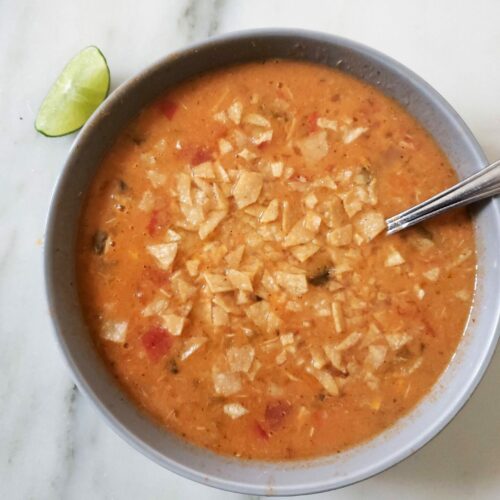
Image resolution: width=500 pixels, height=500 pixels. What are the coordinates of `silver utensil` in the screenshot? It's located at (473, 195).